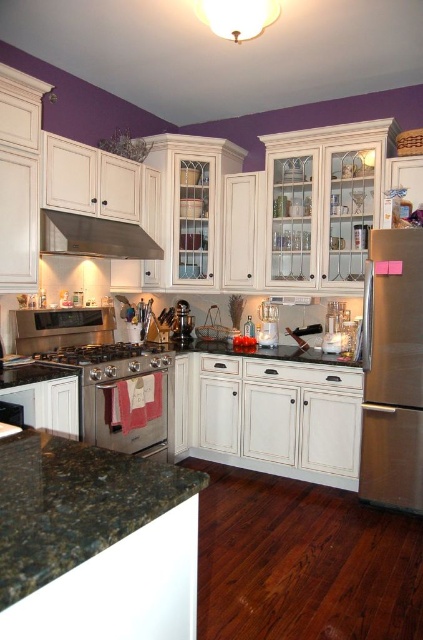
Between stainless steel stove at center and brushed metal coffee pot at center, which one is positioned higher?

brushed metal coffee pot at center is above.

Who is more distant from viewer, (153, 348) or (181, 308)?

The point (181, 308) is behind.

Locate an element on the screen. This screenshot has width=423, height=640. stainless steel stove at center is located at coordinates (98, 353).

Is stainless steel exhaust hood at upper center taller than brushed metal coffee pot at center?

In fact, stainless steel exhaust hood at upper center may be shorter than brushed metal coffee pot at center.

The width and height of the screenshot is (423, 640). Describe the element at coordinates (95, 236) in the screenshot. I see `stainless steel exhaust hood at upper center` at that location.

Between point (77, 248) and point (184, 314), which one is positioned behind?

Point (184, 314)

Locate an element on the screen. The image size is (423, 640). stainless steel exhaust hood at upper center is located at coordinates [95, 236].

This screenshot has width=423, height=640. What do you see at coordinates (95, 236) in the screenshot? I see `stainless steel exhaust hood at upper center` at bounding box center [95, 236].

Who is positioned more to the left, stainless steel exhaust hood at upper center or stainless steel stove at center?

From the viewer's perspective, stainless steel exhaust hood at upper center appears more on the left side.

Who is more distant from viewer, (137, 244) or (71, 358)?

The point (137, 244) is behind.

Locate an element on the screen. stainless steel exhaust hood at upper center is located at coordinates (95, 236).